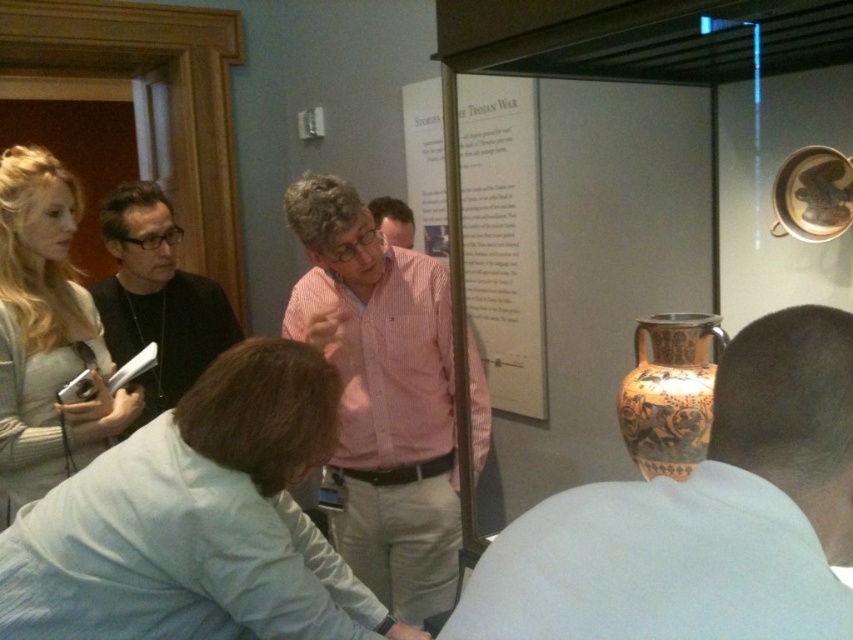
You are a photographer taking a picture of the display case in the museum. You notice the matte orange vase at center and the pink cotton shirt at center. Which object should you focus on first if you want to ensure the closer one is in sharp focus?

The matte orange vase at center is closer to the viewer than the pink cotton shirt at center, so you should focus on the matte orange vase at center first to ensure it is in sharp focus.